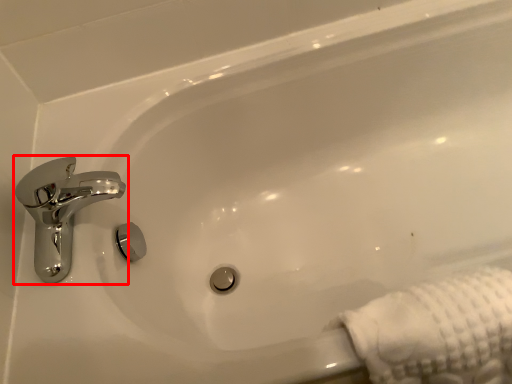
Question: From the image's perspective, where is tap (annotated by the red box) located relative to bath towel?

Choices:
 (A) below
 (B) above

Answer: (B)